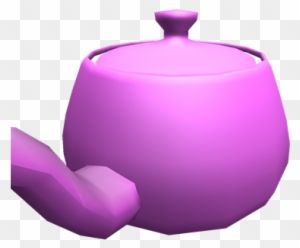
Identify the location of center of teapot. This screenshot has width=300, height=248. (177, 4).